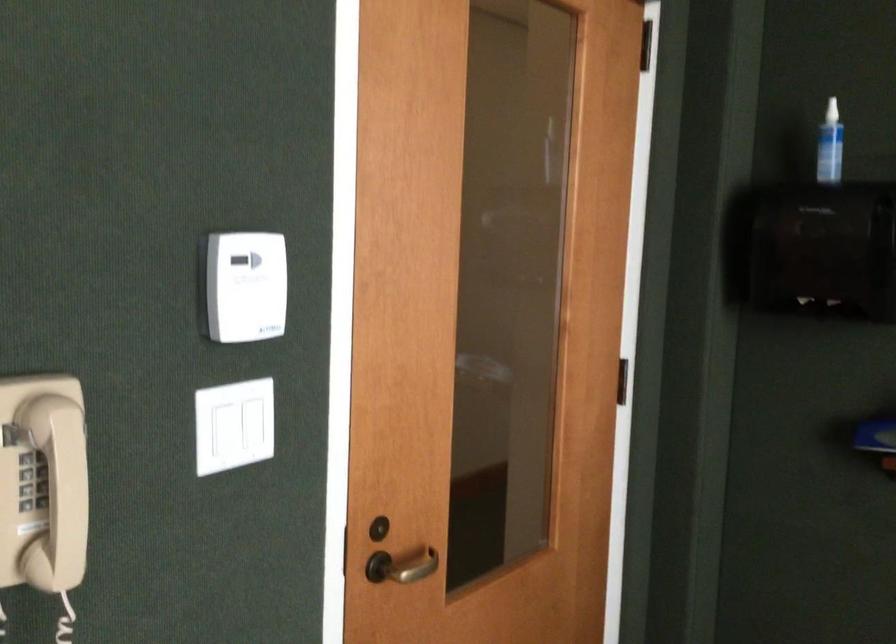
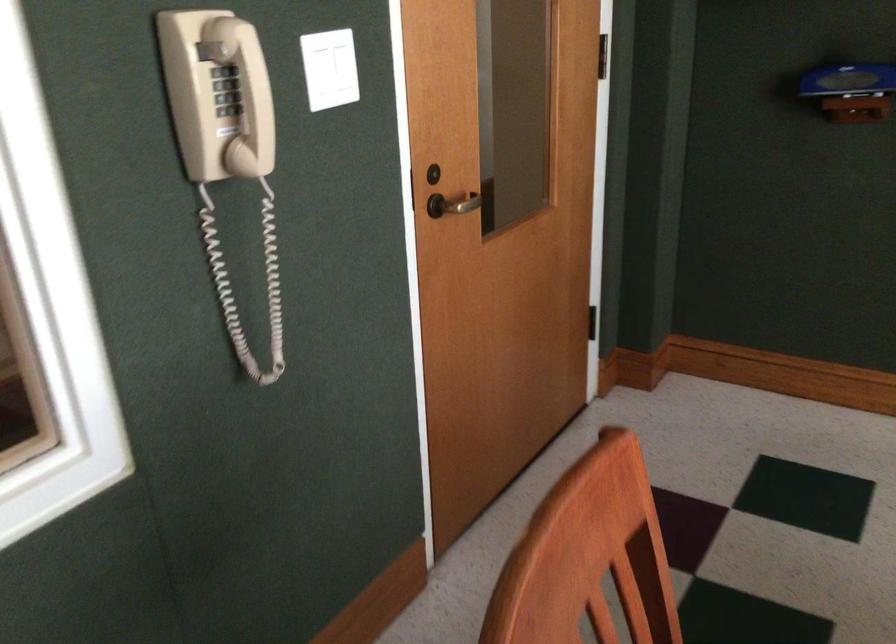
In the second image, find the point that corresponds to the point at 237,430 in the first image.

(330, 69)